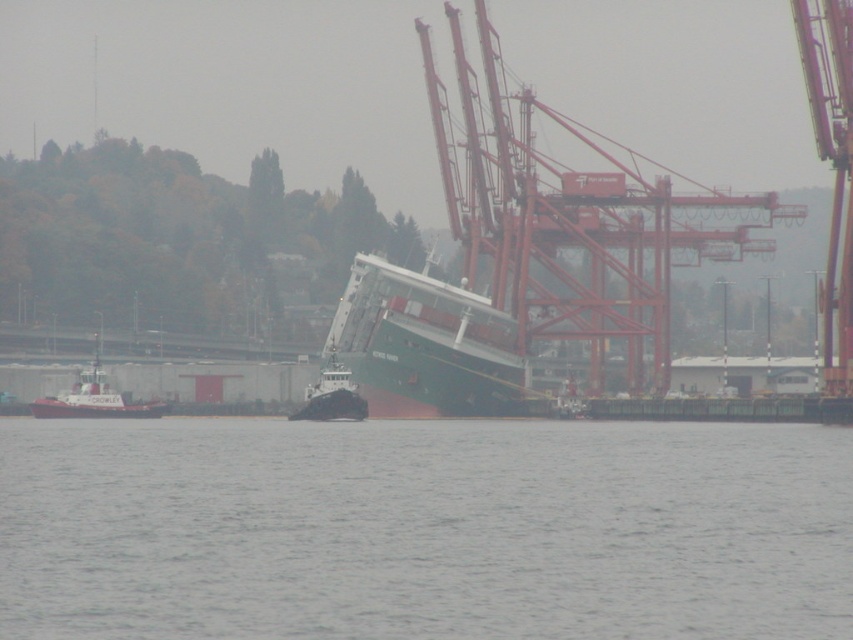
Question: Can you confirm if brushed metal tugboat at left is thinner than black rubber tugboat at center?

Choices:
 (A) no
 (B) yes

Answer: (A)

Question: Which point appears closest to the camera in this image?

Choices:
 (A) (538, 497)
 (B) (434, 388)

Answer: (A)

Question: Which point appears closest to the camera in this image?

Choices:
 (A) (720, 200)
 (B) (109, 410)
 (C) (222, 609)

Answer: (C)

Question: Which point is farther from the camera taking this photo?

Choices:
 (A) (419, 628)
 (B) (38, 397)

Answer: (B)

Question: Does green matte container ship at center appear under black rubber tugboat at center?

Choices:
 (A) no
 (B) yes

Answer: (A)

Question: In this image, where is green matte container ship at center located relative to brushed metal tugboat at left?

Choices:
 (A) right
 (B) left

Answer: (A)